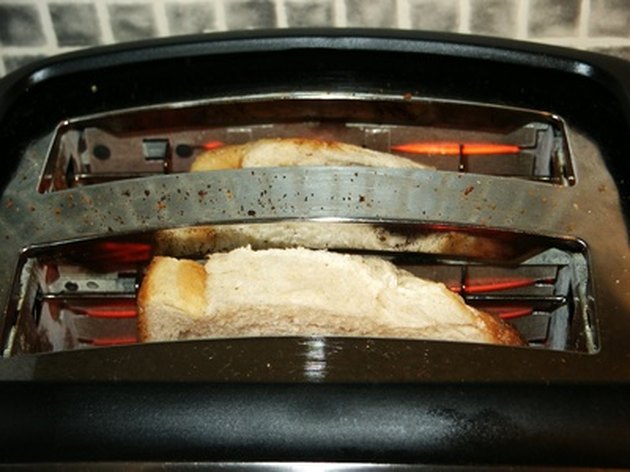
Image resolution: width=630 pixels, height=472 pixels. Find the location of `tile backplash behind  toaster`. tile backplash behind  toaster is located at coordinates (186, 22).